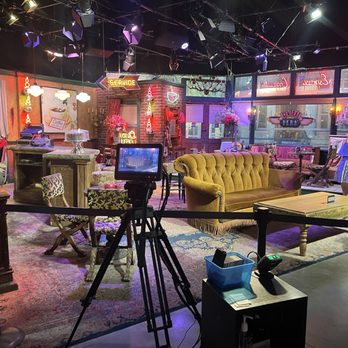
Identify the location of coffee table. The image size is (348, 348). (295, 203).